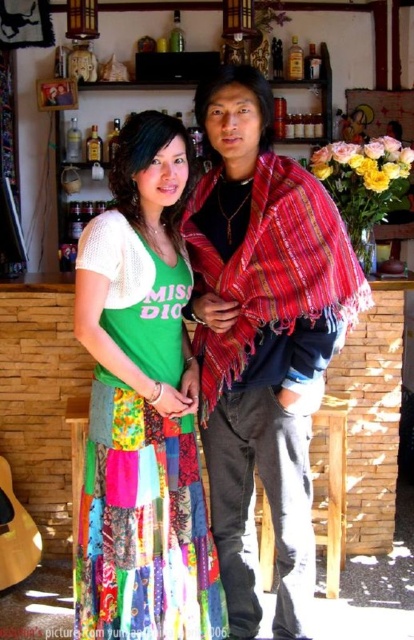
Question: Which object is farther from the camera taking this photo?

Choices:
 (A) colorful patchwork skirt at center
 (B) multicolored patchwork skirt at center
 (C) red woven shawl at center

Answer: (A)

Question: Estimate the real-world distances between objects in this image. Which object is closer to the colorful patchwork skirt at center?

Choices:
 (A) multicolored patchwork skirt at center
 (B) red woven shawl at center

Answer: (A)

Question: Does multicolored patchwork skirt at center appear on the right side of red woven shawl at center?

Choices:
 (A) yes
 (B) no

Answer: (A)

Question: Is multicolored patchwork skirt at center smaller than colorful patchwork skirt at center?

Choices:
 (A) no
 (B) yes

Answer: (A)

Question: Which point is farther to the camera?

Choices:
 (A) (141, 600)
 (B) (361, 305)

Answer: (A)

Question: Is colorful patchwork skirt at center to the left of red woven shawl at center from the viewer's perspective?

Choices:
 (A) yes
 (B) no

Answer: (A)